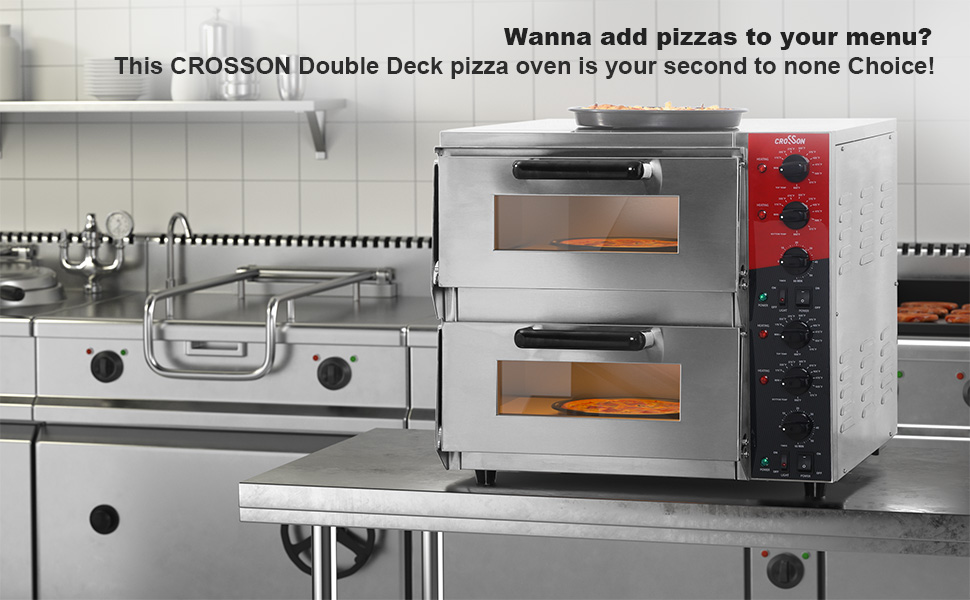
Where is `wall shelf`? wall shelf is located at coordinates point(303,102).